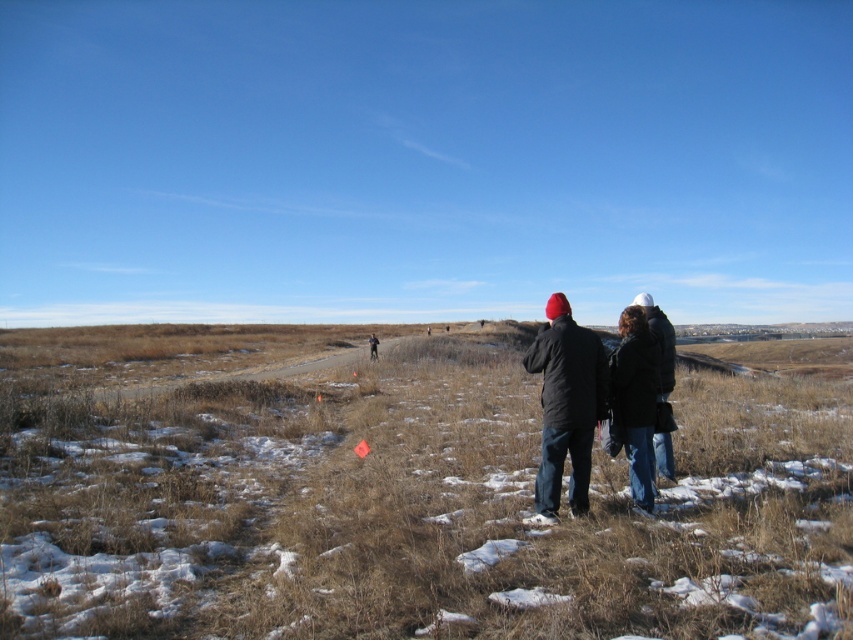
You are trying to decide whether to walk through the dry grass at lower center or around the dark blue jeans at center. Which path would allow you to walk without stepping on anything?

The dry grass at lower center might be wider than dark blue jeans at center, so walking through the dry grass at lower center would likely provide a wider path and avoid stepping on the dark blue jeans at center.

You are standing at the origin point of the image. Looking at the dry grass at lower center, can you determine its exact location in terms of coordinates?

The dry grass at lower center is located at coordinates point (401, 500).

You are a hiker planning to walk along the path in the image. You notice the dry grass at lower center and the black matte jackets at center. Which of these two items occupies more horizontal space in the scene?

The dry grass at lower center occupies more horizontal space because its width is larger than that of the black matte jackets at center.